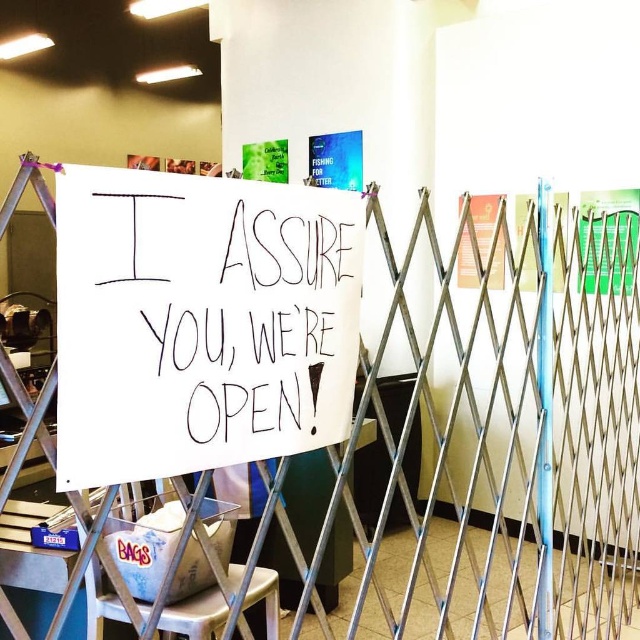
Question: Is white paper sign at center to the left of white plastic stool at lower left from the viewer's perspective?

Choices:
 (A) yes
 (B) no

Answer: (B)

Question: Which of the following is the closest to the observer?

Choices:
 (A) (545, 408)
 (B) (256, 193)

Answer: (B)

Question: Which object is positioned closest to the metallic silver pole at right?

Choices:
 (A) white paper sign at center
 (B) white plastic stool at lower left

Answer: (A)

Question: Is white paper sign at center thinner than metallic silver pole at right?

Choices:
 (A) yes
 (B) no

Answer: (B)

Question: Which is farther from the metallic silver pole at right?

Choices:
 (A) white paper sign at center
 (B) white plastic stool at lower left

Answer: (B)

Question: Can you confirm if metallic silver pole at right is positioned below white plastic stool at lower left?

Choices:
 (A) no
 (B) yes

Answer: (A)